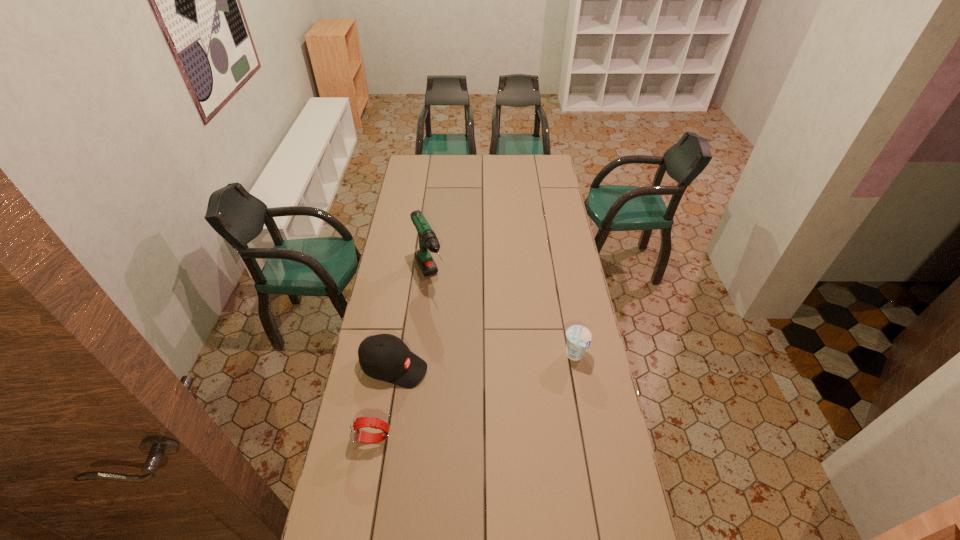
The height and width of the screenshot is (540, 960). I want to click on free space between the tallest object and the baseball cap, so click(412, 322).

Locate an element on the screen. This screenshot has width=960, height=540. free space between the tallest object and the baseball cap is located at coordinates (412, 322).

At what (x,y) coordinates should I click in order to perform the action: click on free space between the yogurt and the nearest object. Please return your answer as a coordinate pair (x, y). The image size is (960, 540). Looking at the image, I should click on (474, 397).

I want to click on free point between the tallest object and the baseball cap, so click(412, 322).

Where is `free space between the watch and the baseball cap`? The image size is (960, 540). free space between the watch and the baseball cap is located at coordinates (384, 403).

I want to click on vacant area that lies between the watch and the baseball cap, so click(384, 403).

Locate an element on the screen. The width and height of the screenshot is (960, 540). vacant region between the baseball cap and the nearest object is located at coordinates (384, 403).

Where is `free space between the farthest object and the rightmost object`? This screenshot has width=960, height=540. free space between the farthest object and the rightmost object is located at coordinates (502, 316).

At what (x,y) coordinates should I click in order to perform the action: click on the closest object to the nearest object. Please return your answer as a coordinate pair (x, y). This screenshot has height=540, width=960. Looking at the image, I should click on (385, 357).

Identify which object is the nearest to the baseball cap. Please provide its 2D coordinates. Your answer should be formatted as a tuple, i.e. [(x, y)], where the tuple contains the x and y coordinates of a point satisfying the conditions above.

[(356, 434)]